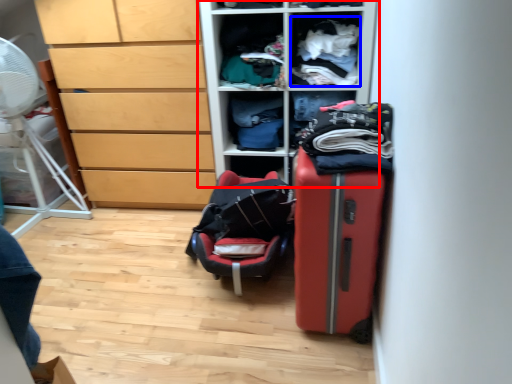
Question: Which of the following is the farthest to the observer, furniture (highlighted by a red box) or clothing (highlighted by a blue box)?

Choices:
 (A) furniture
 (B) clothing

Answer: (B)